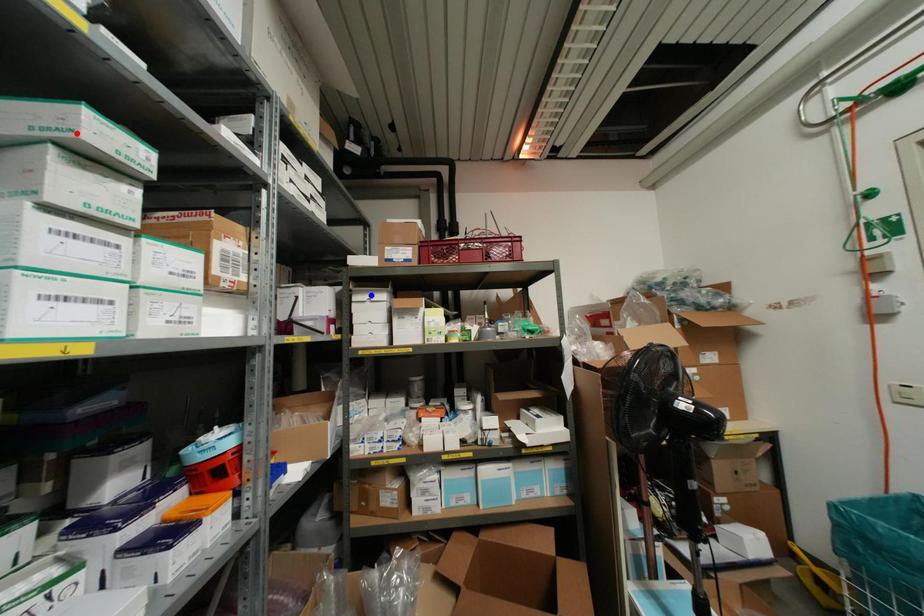
Question: Two points are marked on the image. Which point is closer to the camera?

Choices:
 (A) Blue point is closer.
 (B) Red point is closer.

Answer: (B)